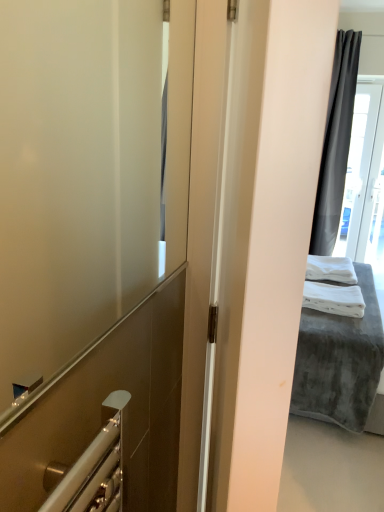
What is the approximate height of transparent glass door at upper right?

5.85 feet.

The height and width of the screenshot is (512, 384). Describe the element at coordinates (334, 298) in the screenshot. I see `white soft towel at right, the first bath towel positioned from the front` at that location.

The height and width of the screenshot is (512, 384). In order to click on white soft towel at right, placed as the second bath towel when sorted from back to front in this screenshot , I will do pyautogui.click(x=334, y=298).

The width and height of the screenshot is (384, 512). Find the location of `transparent glass door at upper right`. transparent glass door at upper right is located at coordinates (361, 170).

Considering the positions of points (358, 106) and (332, 266), is point (358, 106) farther from camera compared to point (332, 266)?

Yes, point (358, 106) is behind point (332, 266).

Considering the relative positions of transparent glass door at upper right and white soft bath towel at right, which is the first bath towel in back-to-front order, in the image provided, is transparent glass door at upper right in front of white soft bath towel at right, which is the first bath towel in back-to-front order,?

No.

Can you confirm if transparent glass door at upper right is taller than white soft bath towel at right, which is the first bath towel in back-to-front order?

Yes, transparent glass door at upper right is taller than white soft bath towel at right, which is the first bath towel in back-to-front order.

From the picture: Is transparent glass door at upper right inside the boundaries of white soft bath towel at right, which is the first bath towel in back-to-front order, or outside?

transparent glass door at upper right is not inside white soft bath towel at right, which is the first bath towel in back-to-front order, it's outside.

From a real-world perspective, which is physically above, white soft towel at right, placed as the second bath towel when sorted from back to front, or white soft fabric bed at right?

white soft towel at right, placed as the second bath towel when sorted from back to front, is physically above.

Considering the relative positions of white soft towel at right, the first bath towel positioned from the front, and white soft fabric bed at right in the image provided, is white soft towel at right, the first bath towel positioned from the front, behind white soft fabric bed at right?

That is True.

Is white soft towel at right, placed as the second bath towel when sorted from back to front, spatially inside white soft fabric bed at right, or outside of it?

white soft towel at right, placed as the second bath towel when sorted from back to front, fits inside white soft fabric bed at right.

Is white soft towel at right, the first bath towel positioned from the front, not near white soft fabric bed at right?

No, white soft towel at right, the first bath towel positioned from the front, is not far away from white soft fabric bed at right.

In the image, there is a white soft bath towel at right, the second bath towel positioned from the front. Where is `bed below it (from the image's perspective)`? This screenshot has height=512, width=384. bed below it (from the image's perspective) is located at coordinates (339, 361).

How much distance is there between white soft bath towel at right, which is the first bath towel in back-to-front order, and white soft fabric bed at right?

A distance of 19.96 inches exists between white soft bath towel at right, which is the first bath towel in back-to-front order, and white soft fabric bed at right.

From the image's perspective, which is above, white soft bath towel at right, which is the first bath towel in back-to-front order, or white soft fabric bed at right?

white soft bath towel at right, which is the first bath towel in back-to-front order.

Would you say white soft bath towel at right, which is the first bath towel in back-to-front order, is inside or outside white soft fabric bed at right?

white soft bath towel at right, which is the first bath towel in back-to-front order, is enclosed within white soft fabric bed at right.

Is transparent glass door at upper right situated inside white soft fabric bed at right or outside?

The correct answer is: outside.

Which of these two, transparent glass door at upper right or white soft fabric bed at right, is thinner?

transparent glass door at upper right.

Is point (380, 153) positioned behind point (330, 419)?

Yes, it is.

Which object is positioned more to the left, white soft bath towel at right, which is the first bath towel in back-to-front order, or transparent glass door at upper right?

From the viewer's perspective, white soft bath towel at right, which is the first bath towel in back-to-front order, appears more on the left side.

Looking at the image, does white soft bath towel at right, which is the first bath towel in back-to-front order, seem bigger or smaller compared to transparent glass door at upper right?

Clearly, white soft bath towel at right, which is the first bath towel in back-to-front order, is smaller in size than transparent glass door at upper right.

Measure the distance from white soft bath towel at right, the second bath towel positioned from the front, to transparent glass door at upper right.

white soft bath towel at right, the second bath towel positioned from the front, is 5.15 feet from transparent glass door at upper right.

Can you confirm if white soft bath towel at right, the second bath towel positioned from the front, is shorter than transparent glass door at upper right?

Yes.

Considering the sizes of white soft fabric bed at right and white soft towel at right, the first bath towel positioned from the front, in the image, is white soft fabric bed at right bigger or smaller than white soft towel at right, the first bath towel positioned from the front,?

white soft fabric bed at right is bigger than white soft towel at right, the first bath towel positioned from the front.

Considering the relative positions of white soft fabric bed at right and white soft towel at right, placed as the second bath towel when sorted from back to front, in the image provided, is white soft fabric bed at right to the left of white soft towel at right, placed as the second bath towel when sorted from back to front, from the viewer's perspective?

In fact, white soft fabric bed at right is to the right of white soft towel at right, placed as the second bath towel when sorted from back to front.

Considering the sizes of objects white soft fabric bed at right and white soft towel at right, the first bath towel positioned from the front, in the image provided, who is wider, white soft fabric bed at right or white soft towel at right, the first bath towel positioned from the front,?

white soft fabric bed at right.

Would you consider white soft fabric bed at right to be distant from white soft towel at right, the first bath towel positioned from the front?

white soft fabric bed at right is actually quite close to white soft towel at right, the first bath towel positioned from the front.

Considering the positions of point (363, 148) and point (336, 300), is point (363, 148) closer or farther from the camera than point (336, 300)?

Point (363, 148) is farther from the camera than point (336, 300).

Does transparent glass door at upper right lie behind white soft towel at right, the first bath towel positioned from the front?

Yes, transparent glass door at upper right is further from the viewer.

Could you tell me if transparent glass door at upper right is facing white soft towel at right, placed as the second bath towel when sorted from back to front?

Yes, transparent glass door at upper right faces towards white soft towel at right, placed as the second bath towel when sorted from back to front.

How distant is transparent glass door at upper right from white soft towel at right, the first bath towel positioned from the front?

2.16 meters.

There is a transparent glass door at upper right. In order to click on the 1st bath towel below it (from the image's perspective) in this screenshot , I will do `click(330, 269)`.

This screenshot has height=512, width=384. In order to click on the 2nd bath towel to the left of the white soft fabric bed at right, counting from the anchor's position in this screenshot , I will do `click(334, 298)`.

From the image, which object appears to be nearer to white soft towel at right, the first bath towel positioned from the front, white soft bath towel at right, the second bath towel positioned from the front, or white soft fabric bed at right?

white soft fabric bed at right is closer to white soft towel at right, the first bath towel positioned from the front.

Estimate the real-world distances between objects in this image. Which object is closer to transparent glass door at upper right, white soft towel at right, placed as the second bath towel when sorted from back to front, or white soft fabric bed at right?

The object closer to transparent glass door at upper right is white soft towel at right, placed as the second bath towel when sorted from back to front.

Which object lies further to the anchor point white soft fabric bed at right, white soft bath towel at right, which is the first bath towel in back-to-front order, or white soft towel at right, the first bath towel positioned from the front?

white soft bath towel at right, which is the first bath towel in back-to-front order, is further to white soft fabric bed at right.

Which object lies further to the anchor point white soft bath towel at right, which is the first bath towel in back-to-front order, white soft fabric bed at right or white soft towel at right, placed as the second bath towel when sorted from back to front?

Based on the image, white soft fabric bed at right appears to be further to white soft bath towel at right, which is the first bath towel in back-to-front order.

When comparing their distances from white soft fabric bed at right, does white soft bath towel at right, the second bath towel positioned from the front, or transparent glass door at upper right seem further?

transparent glass door at upper right is positioned further to the anchor white soft fabric bed at right.

From the image, which object appears to be farther from white soft towel at right, the first bath towel positioned from the front, transparent glass door at upper right or white soft bath towel at right, which is the first bath towel in back-to-front order?

transparent glass door at upper right is further to white soft towel at right, the first bath towel positioned from the front.

Based on their spatial positions, is white soft towel at right, placed as the second bath towel when sorted from back to front, or transparent glass door at upper right closer to white soft fabric bed at right?

Among the two, white soft towel at right, placed as the second bath towel when sorted from back to front, is located nearer to white soft fabric bed at right.

Which object lies further to the anchor point white soft bath towel at right, the second bath towel positioned from the front, white soft towel at right, the first bath towel positioned from the front, or transparent glass door at upper right?

transparent glass door at upper right is positioned further to the anchor white soft bath towel at right, the second bath towel positioned from the front.

You are a GUI agent. You are given a task and a screenshot of the screen. Output one action in this format:
    pyautogui.click(x=<x>, y=<y>)
    Task: Click on the bath towel between white soft fabric bed at right and white soft bath towel at right, the second bath towel positioned from the front, from front to back
    This screenshot has width=384, height=512.
    Given the screenshot: What is the action you would take?
    pyautogui.click(x=334, y=298)

This screenshot has width=384, height=512. I want to click on bath towel located between white soft towel at right, placed as the second bath towel when sorted from back to front, and transparent glass door at upper right in the depth direction, so click(330, 269).